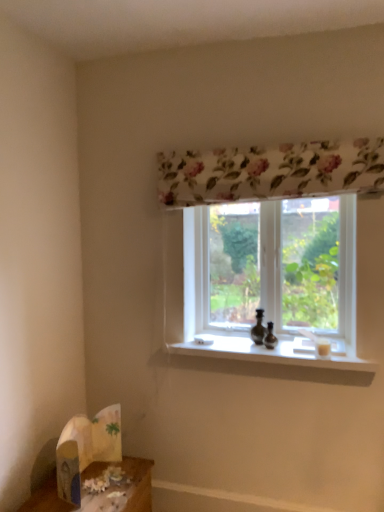
Question: Considering the positions of point (281, 349) and point (296, 266), is point (281, 349) closer or farther from the camera than point (296, 266)?

Choices:
 (A) closer
 (B) farther

Answer: (A)

Question: In terms of width, does white smooth window sill at center look wider or thinner when compared to transparent glass window at center?

Choices:
 (A) wide
 (B) thin

Answer: (A)

Question: Which of these objects is positioned farthest from the transparent glass window at center?

Choices:
 (A) white smooth window sill at center
 (B) wooden table at lower left
 (C) white paper bag at lower left

Answer: (B)

Question: Estimate the real-world distances between objects in this image. Which object is closer to the wooden table at lower left?

Choices:
 (A) white paper bag at lower left
 (B) white smooth window sill at center
 (C) transparent glass window at center

Answer: (A)